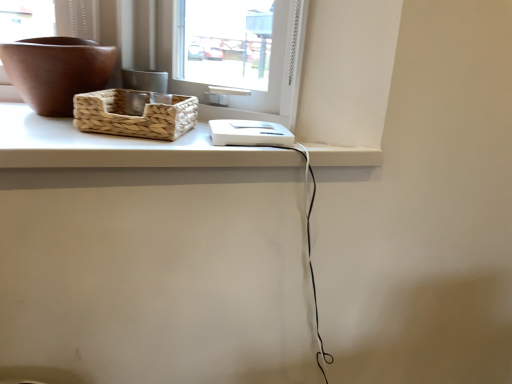
Question: Considering their positions, is brown matte bowl at upper left located in front of or behind white matte counter top at upper center?

Choices:
 (A) front
 (B) behind

Answer: (B)

Question: In the image, is brown matte bowl at upper left on the left side or the right side of white matte counter top at upper center?

Choices:
 (A) left
 (B) right

Answer: (A)

Question: Which is farther from the woven natural picnic basket at upper left?

Choices:
 (A) brown matte bowl at upper left
 (B) white matte counter top at upper center

Answer: (A)

Question: Which object is the farthest from the brown matte bowl at upper left?

Choices:
 (A) woven natural picnic basket at upper left
 (B) white matte counter top at upper center

Answer: (B)